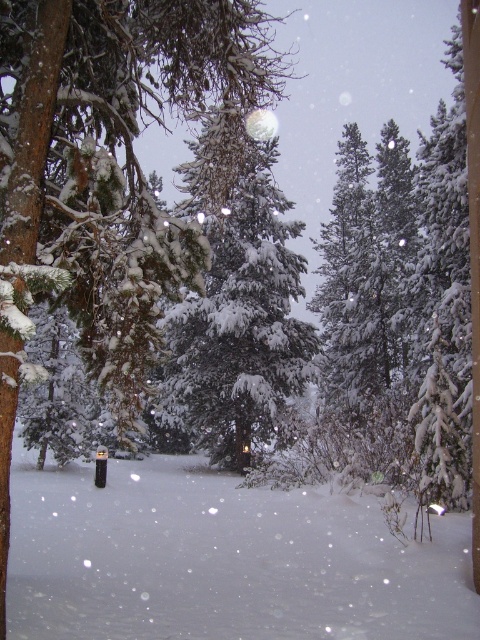
Does snow-covered evergreen tree at center lie in front of green textured pine tree at center?

Yes.

In the scene shown: Who is shorter, snow-covered evergreen tree at center or green textured pine tree at center?

green textured pine tree at center

This screenshot has width=480, height=640. In order to click on snow-covered evergreen tree at center in this screenshot , I will do `click(103, 156)`.

Between point (319, 616) and point (229, 164), which one is positioned behind?

The point (229, 164) is behind.

Looking at this image, which is above, white fluffy snow at center or green textured pine tree at center?

green textured pine tree at center is above.

Find the location of a particular element. white fluffy snow at center is located at coordinates (223, 561).

The image size is (480, 640). Find the location of `white fluffy snow at center`. white fluffy snow at center is located at coordinates (223, 561).

Between point (113, 620) and point (67, 145), which one is positioned in front?

Positioned in front is point (67, 145).

At what (x,y) coordinates should I click in order to perform the action: click on white fluffy snow at center. Please return your answer as a coordinate pair (x, y). Image resolution: width=480 pixels, height=640 pixels. Looking at the image, I should click on tap(223, 561).

Is point (130, 586) in front of point (82, 154)?

No, (130, 586) is behind (82, 154).

Locate an element on the screen. The image size is (480, 640). white fluffy snow at center is located at coordinates (223, 561).